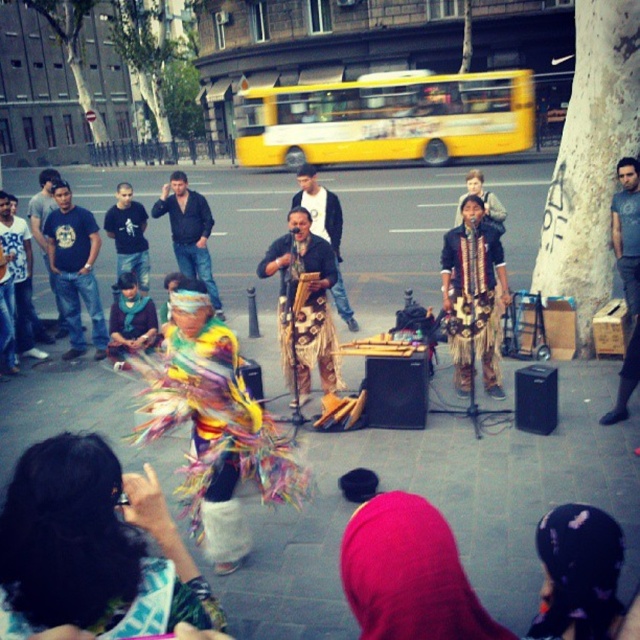
What do you see at coordinates (76, 268) in the screenshot? I see `jeans at left` at bounding box center [76, 268].

Locate an element on the screen. jeans at left is located at coordinates (76, 268).

Does leather-like fabric at center appear under dark blue shirt at center?

Incorrect, leather-like fabric at center is not positioned below dark blue shirt at center.

I want to click on leather-like fabric at center, so click(324, 230).

Does jeans at left appear on the right side of dark blue leather jacket at center?

Incorrect, jeans at left is not on the right side of dark blue leather jacket at center.

From the picture: Does jeans at left have a smaller size compared to dark blue leather jacket at center?

Yes.

Find the location of a particular element. Image resolution: width=640 pixels, height=640 pixels. jeans at left is located at coordinates (76, 268).

This screenshot has width=640, height=640. Identify the location of jeans at left. (76, 268).